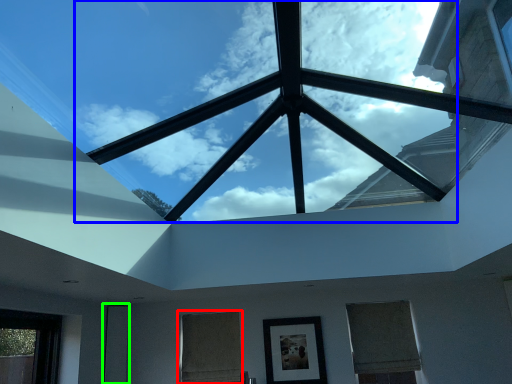
Question: Which object is positioned farthest from window (highlighted by a red box)? Select from cloud (highlighted by a blue box) and glass door (highlighted by a green box).

Choices:
 (A) cloud
 (B) glass door

Answer: (A)